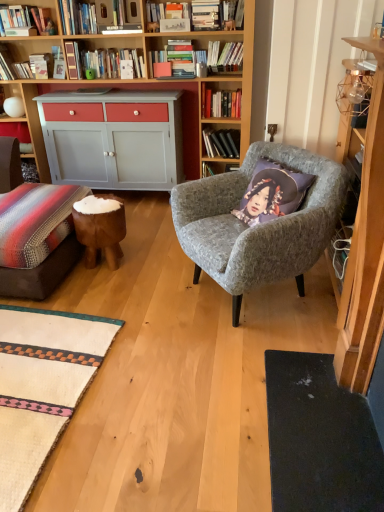
Question: Looking at their shapes, would you say hardcover book at upper center, which ranks as the third book in bottom-to-top order, is wider or thinner than wooden bookshelf at upper left, which is the second shelf from bottom to top?

Choices:
 (A) wide
 (B) thin

Answer: (A)

Question: Is hardcover book at upper center, the 2th book from the top, to the left or to the right of wooden bookshelf at upper left, which is the second shelf from bottom to top, in the image?

Choices:
 (A) left
 (B) right

Answer: (B)

Question: Which object is positioned farthest from the hardcover books at upper center, which is the 3th book from top to bottom?

Choices:
 (A) wooden bookshelf at upper left, arranged as the first shelf when viewed from the front
 (B) matte gray cabinet at left, positioned as the 2th shelf in top-to-bottom order
 (C) brown wooden stool at lower left
 (D) hardcover book at upper center, which is the 2th book from left to right
 (E) hardcover books at upper center, the second book positioned from the front

Answer: (B)

Question: Based on their relative distances, which object is farther from the brown wooden stool at lower left?

Choices:
 (A) hardcover books at upper center, acting as the 3th book starting from the left
 (B) hardcover books at upper center, arranged as the first book when viewed from the top
 (C) white plastic book at upper right, the fourth book when ordered from left to right
 (D) matte gray cabinet at left, which is counted as the first shelf, starting from the back
 (E) metallic gold cabinet at upper right

Answer: (C)